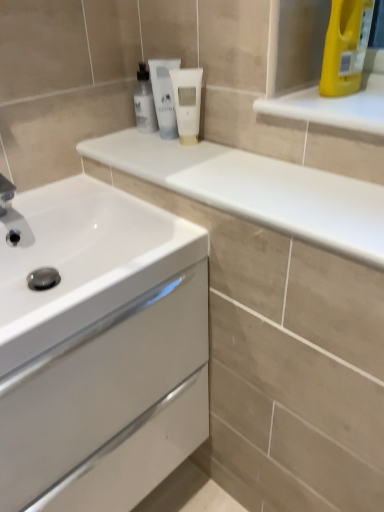
Question: Is the depth of yellow plastic bottle at upper right less than that of white glossy countertop at upper center?

Choices:
 (A) yes
 (B) no

Answer: (B)

Question: From the image's perspective, is yellow plastic bottle at upper right above white glossy countertop at upper center?

Choices:
 (A) yes
 (B) no

Answer: (A)

Question: Considering the relative sizes of yellow plastic bottle at upper right and white glossy countertop at upper center in the image provided, is yellow plastic bottle at upper right smaller than white glossy countertop at upper center?

Choices:
 (A) yes
 (B) no

Answer: (A)

Question: Is yellow plastic bottle at upper right turned away from white glossy countertop at upper center?

Choices:
 (A) no
 (B) yes

Answer: (A)

Question: Considering the relative sizes of yellow plastic bottle at upper right and white glossy countertop at upper center in the image provided, is yellow plastic bottle at upper right shorter than white glossy countertop at upper center?

Choices:
 (A) yes
 (B) no

Answer: (B)

Question: Is yellow plastic bottle at upper right outside of white glossy countertop at upper center?

Choices:
 (A) yes
 (B) no

Answer: (A)

Question: From a real-world perspective, is white glossy cabinet at lower left physically above white matte tube at center, acting as the 2th mouthwash starting from the left?

Choices:
 (A) no
 (B) yes

Answer: (A)

Question: Would you say white glossy cabinet at lower left contains white matte tube at center, acting as the 2th mouthwash starting from the left?

Choices:
 (A) yes
 (B) no

Answer: (B)

Question: Is white glossy cabinet at lower left bigger than white matte tube at center, which appears as the second mouthwash when viewed from the right?

Choices:
 (A) no
 (B) yes

Answer: (B)

Question: Is white glossy cabinet at lower left with white matte tube at center, acting as the 2th mouthwash starting from the left?

Choices:
 (A) no
 (B) yes

Answer: (A)

Question: Is white glossy cabinet at lower left further to the viewer compared to white matte tube at center, acting as the 2th mouthwash starting from the left?

Choices:
 (A) yes
 (B) no

Answer: (B)

Question: Can we say white glossy cabinet at lower left lies outside white matte tube at center, which appears as the second mouthwash when viewed from the right?

Choices:
 (A) yes
 (B) no

Answer: (A)

Question: Is white matte tube at center, which appears as the second mouthwash when viewed from the right, smaller than white glossy cabinet at lower left?

Choices:
 (A) no
 (B) yes

Answer: (B)